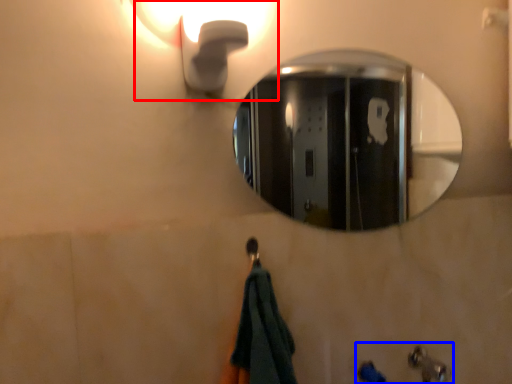
Question: Which object appears farthest to the camera in this image, light fixture (highlighted by a red box) or sink (highlighted by a blue box)?

Choices:
 (A) light fixture
 (B) sink

Answer: (B)